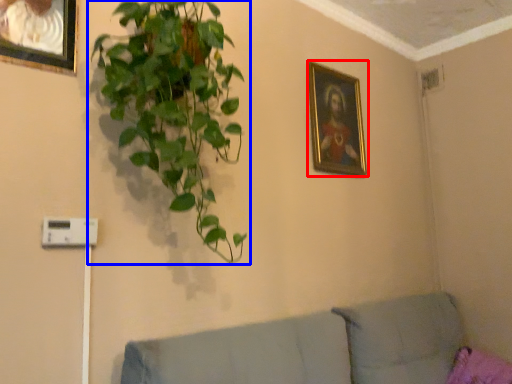
Question: Which of the following is the farthest to the observer, picture frame (highlighted by a red box) or houseplant (highlighted by a blue box)?

Choices:
 (A) picture frame
 (B) houseplant

Answer: (A)